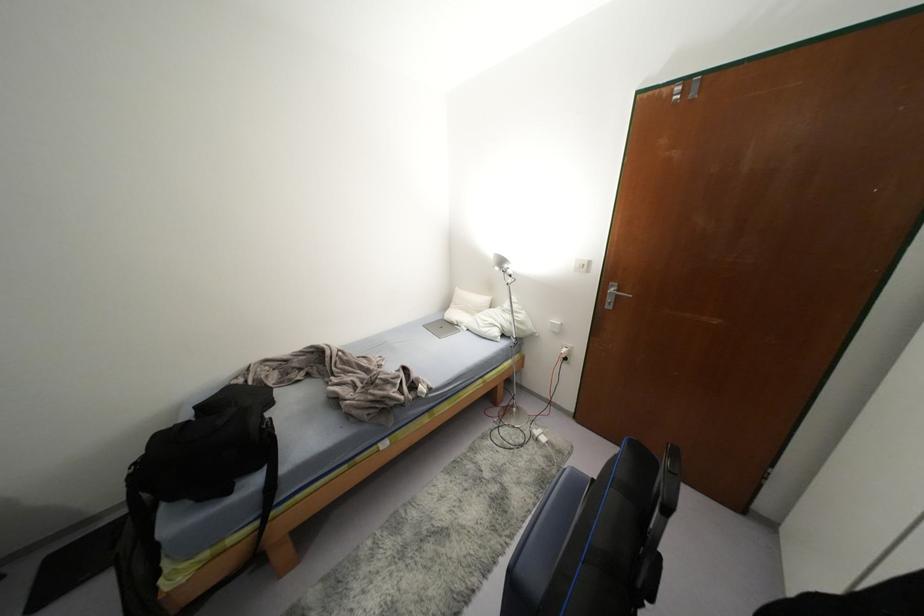
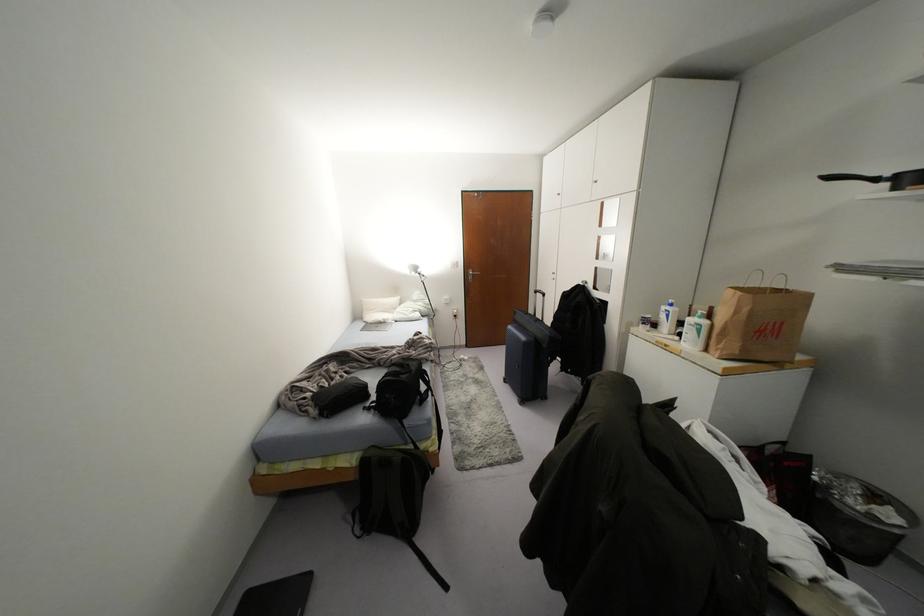
In the second image, find the point that corresponds to (x=586, y=265) in the first image.

(456, 264)